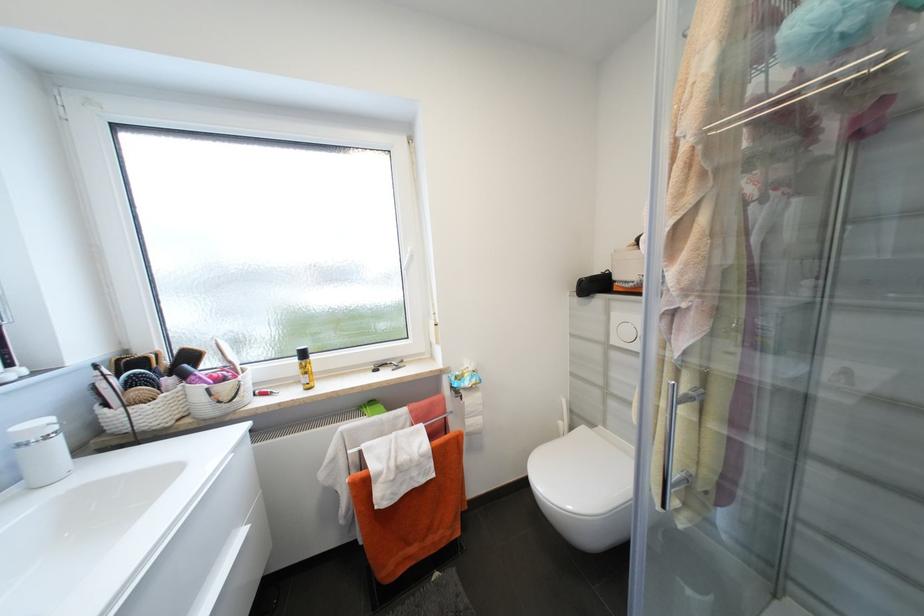
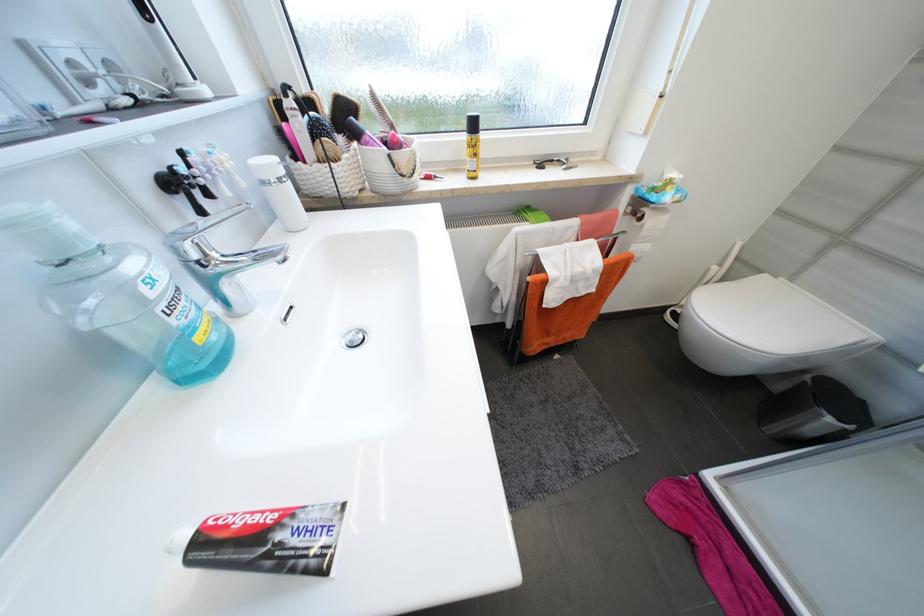
Find the pixel in the second image that matches (468,399) in the first image.

(647, 219)